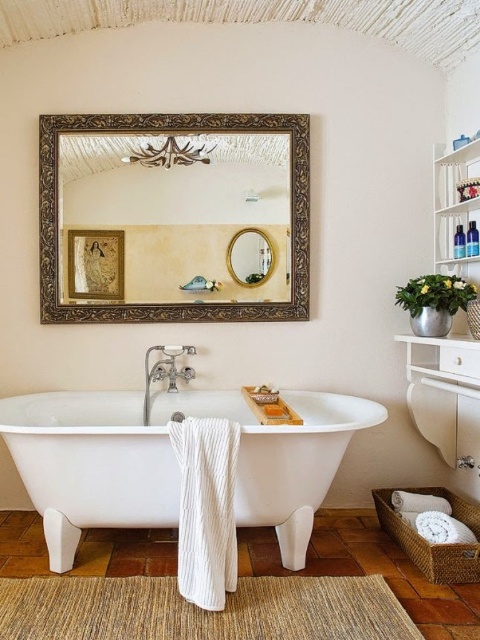
Question: Is white glossy bathtub at center thinner than woven rattan basket at lower right?

Choices:
 (A) no
 (B) yes

Answer: (A)

Question: Where is gold ornate mirror at upper center located in relation to woven rattan basket at lower right in the image?

Choices:
 (A) below
 (B) above

Answer: (B)

Question: Which object is closer to the camera taking this photo?

Choices:
 (A) white glossy bathtub at center
 (B) woven rattan basket at lower right

Answer: (A)

Question: Which point appears farthest from the camera in this image?

Choices:
 (A) (x=478, y=205)
 (B) (x=409, y=525)

Answer: (A)

Question: Estimate the real-world distances between objects in this image. Which object is farther from the white plastic shelf at upper right?

Choices:
 (A) white glossy bathtub at center
 (B) white glossy vanity at lower right

Answer: (A)

Question: Where is gold ornate mirror at upper center located in relation to woven rattan basket at lower right in the image?

Choices:
 (A) below
 (B) above

Answer: (B)